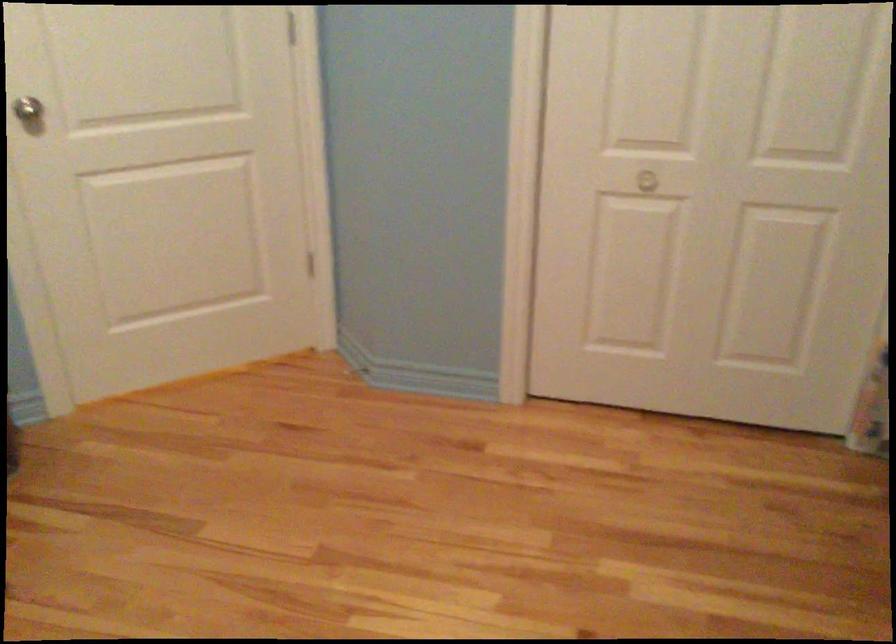
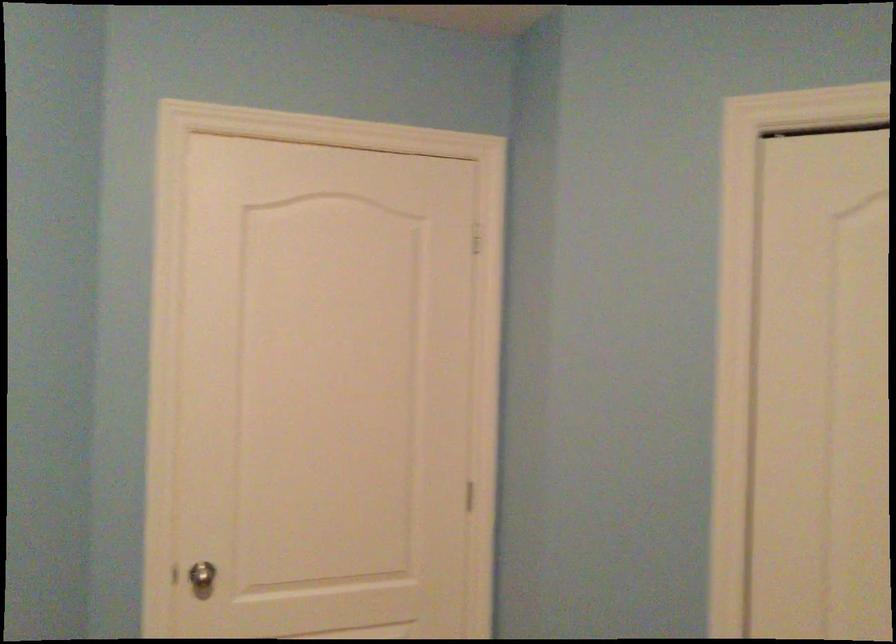
What movement of the cameraman would produce the second image?

The cameraman walked toward left, forward.